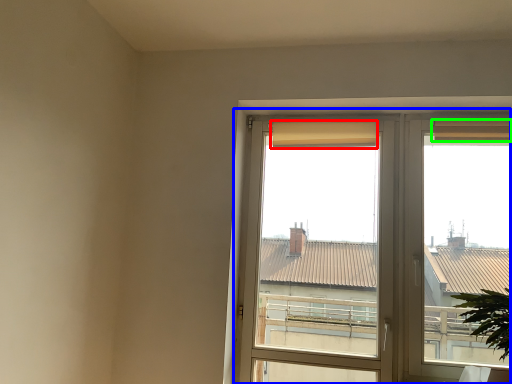
Question: Estimate the real-world distances between objects in this image. Which object is farther from curtain (highlighted by a red box), window (highlighted by a blue box) or curtain (highlighted by a green box)?

Choices:
 (A) window
 (B) curtain

Answer: (B)